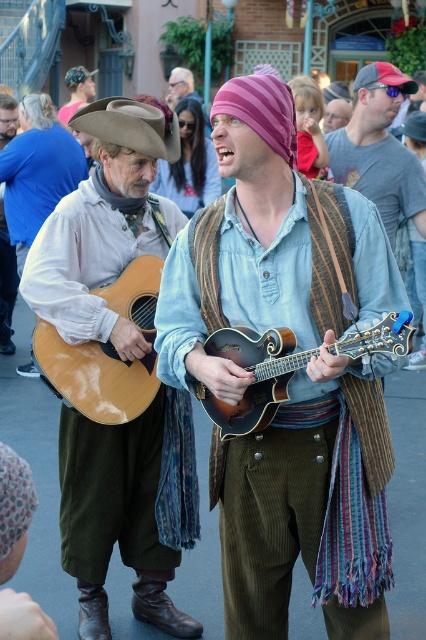
Question: Estimate the real-world distances between objects in this image. Which object is closer to the denim shirt at center?

Choices:
 (A) glossy wood guitar at left
 (B) matte brown guitar at left
 (C) wooden mandolin at center
 (D) brown felt cowboy hat at upper left

Answer: (D)

Question: Which point appears closest to the camera in this image?

Choices:
 (A) 143,324
 (B) 95,145
 (C) 363,296

Answer: (C)

Question: Which of the following is the farthest from the observer?

Choices:
 (A) (157, 269)
 (B) (416, 209)
 (C) (365, 348)

Answer: (B)

Question: Is matte brown guitar at left to the left of brown felt cowboy hat at upper left from the viewer's perspective?

Choices:
 (A) yes
 (B) no

Answer: (A)

Question: Can you confirm if wooden mandolin at center is positioned to the right of denim shirt at center?

Choices:
 (A) yes
 (B) no

Answer: (B)

Question: Does striped fabric mandolin at center lie in front of glossy wood guitar at left?

Choices:
 (A) no
 (B) yes

Answer: (B)